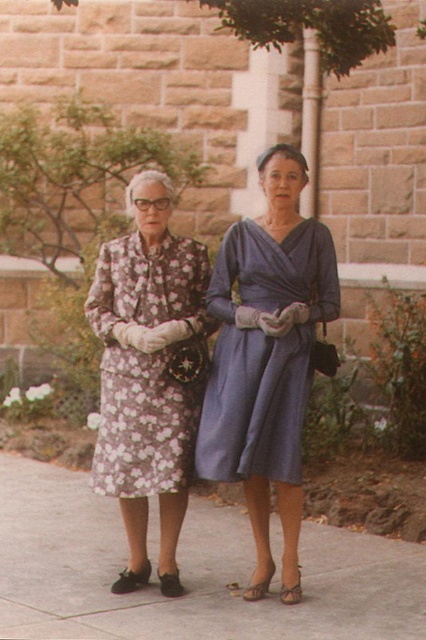
Is point (193, 592) positioned behind point (158, 305)?

No, (193, 592) is closer to viewer.

Can you confirm if gray concrete pavement at center is bigger than floral-patterned fabric dress at left?

Indeed, gray concrete pavement at center has a larger size compared to floral-patterned fabric dress at left.

Who is more forward, (92, 531) or (149, 449)?

Point (149, 449)

Where is `gray concrete pavement at center`? The height and width of the screenshot is (640, 426). gray concrete pavement at center is located at coordinates (187, 572).

Who is higher up, gray concrete pavement at center or matte blue dress at center?

matte blue dress at center is above.

The height and width of the screenshot is (640, 426). What do you see at coordinates (187, 572) in the screenshot? I see `gray concrete pavement at center` at bounding box center [187, 572].

In order to click on gray concrete pavement at center in this screenshot , I will do `click(187, 572)`.

Who is positioned more to the right, matte blue dress at center or floral-patterned fabric dress at left?

matte blue dress at center

Is matte blue dress at center smaller than floral-patterned fabric dress at left?

Actually, matte blue dress at center might be larger than floral-patterned fabric dress at left.

Locate an element on the screen. The width and height of the screenshot is (426, 640). matte blue dress at center is located at coordinates (262, 352).